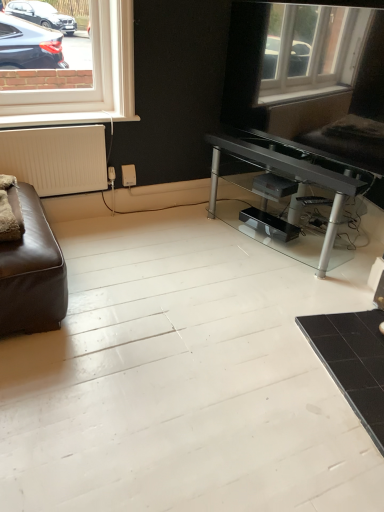
Measure the distance between point (362, 333) and camera.

Point (362, 333) is 6.20 feet from camera.

At what (x,y) coordinates should I click in order to perform the action: click on black matte table at lower right. Please return your answer as a coordinate pair (x, y). This screenshot has width=384, height=512. Looking at the image, I should click on (353, 361).

The image size is (384, 512). Describe the element at coordinates (353, 361) in the screenshot. I see `black matte table at lower right` at that location.

Locate an element on the screen. Image resolution: width=384 pixels, height=512 pixels. white matte radiator at left is located at coordinates (56, 158).

Describe the element at coordinates (56, 158) in the screenshot. I see `white matte radiator at left` at that location.

Where is `black matte table at lower right`? Image resolution: width=384 pixels, height=512 pixels. black matte table at lower right is located at coordinates (353, 361).

Looking at this image, would you say black matte table at lower right is to the left or to the right of white matte radiator at left in the picture?

In the image, black matte table at lower right appears on the right side of white matte radiator at left.

Which is behind, black matte table at lower right or white matte radiator at left?

white matte radiator at left is further from the camera.

Between point (374, 325) and point (77, 170), which one is positioned behind?

Positioned behind is point (77, 170).

From the image's perspective, relative to white matte radiator at left, is black matte table at lower right above or below?

black matte table at lower right is below white matte radiator at left.

From a real-world perspective, between black matte table at lower right and white matte radiator at left, who is vertically higher?

white matte radiator at left, from a real-world perspective.

Is black matte table at lower right wider or thinner than white matte radiator at left?

Considering their sizes, black matte table at lower right looks broader than white matte radiator at left.

Is black matte table at lower right taller than white matte radiator at left?

No.

Is black matte table at lower right smaller than white matte radiator at left?

Yes.

Is white matte radiator at left inside black matte table at lower right?

No, white matte radiator at left is not inside black matte table at lower right.

Is black matte table at lower right not close to white matte radiator at left?

Absolutely, black matte table at lower right is distant from white matte radiator at left.

Could you tell me if black matte table at lower right is facing white matte radiator at left?

No, black matte table at lower right does not turn towards white matte radiator at left.

What's the angular difference between black matte table at lower right and white matte radiator at left's facing directions?

black matte table at lower right and white matte radiator at left are facing 104 degrees away from each other.

Measure the distance from black matte table at lower right to white matte radiator at left.

They are 1.72 meters apart.

You are a GUI agent. You are given a task and a screenshot of the screen. Output one action in this format:
    pyautogui.click(x=<x>, y=<y>)
    Task: Click on the radiator on the left of the black matte table at lower right
    This screenshot has width=384, height=512.
    Given the screenshot: What is the action you would take?
    pyautogui.click(x=56, y=158)

Does white matte radiator at left appear on the right side of black matte table at lower right?

Incorrect, white matte radiator at left is not on the right side of black matte table at lower right.

Who is more distant, white matte radiator at left or black matte table at lower right?

Positioned behind is white matte radiator at left.

Is point (21, 165) in front of point (352, 319)?

No, (21, 165) is further to viewer.

From the image's perspective, would you say white matte radiator at left is shown under black matte table at lower right?

No, from the image's perspective, white matte radiator at left is not beneath black matte table at lower right.

From a real-world perspective, is white matte radiator at left above or below black matte table at lower right?

white matte radiator at left is situated higher than black matte table at lower right in the real world.

Which object is wider, white matte radiator at left or black matte table at lower right?

black matte table at lower right.

Considering the relative sizes of white matte radiator at left and black matte table at lower right in the image provided, is white matte radiator at left taller than black matte table at lower right?

Yes.

Based on their sizes in the image, would you say white matte radiator at left is bigger or smaller than black matte table at lower right?

white matte radiator at left is bigger than black matte table at lower right.

Can black matte table at lower right be found inside white matte radiator at left?

No, black matte table at lower right is not surrounded by white matte radiator at left.

Are white matte radiator at left and black matte table at lower right far apart?

Yes.

Could you tell me if white matte radiator at left is facing black matte table at lower right?

Yes, white matte radiator at left is aimed at black matte table at lower right.

Image resolution: width=384 pixels, height=512 pixels. Identify the location of radiator located above the black matte table at lower right (from a real-world perspective). (56, 158).

Locate an element on the screen. table on the right of white matte radiator at left is located at coordinates (353, 361).

The height and width of the screenshot is (512, 384). Find the location of `radiator located above the black matte table at lower right (from a real-world perspective)`. radiator located above the black matte table at lower right (from a real-world perspective) is located at coordinates (56, 158).